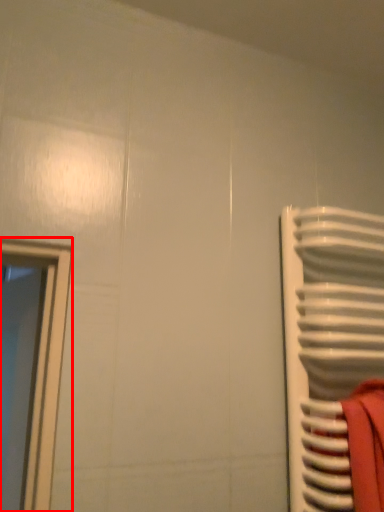
Question: Where is window (annotated by the red box) located in relation to radiator in the image?

Choices:
 (A) right
 (B) left

Answer: (B)